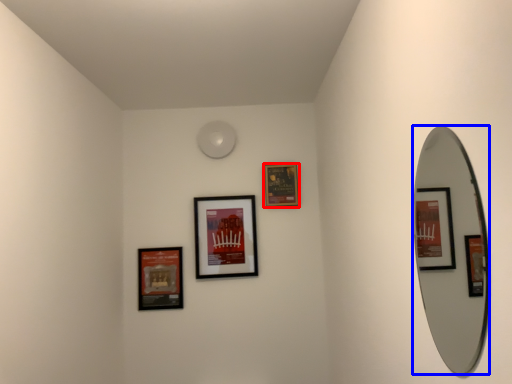
Question: Which object appears closest to the camera in this image, picture frame (highlighted by a red box) or mirror (highlighted by a blue box)?

Choices:
 (A) picture frame
 (B) mirror

Answer: (B)